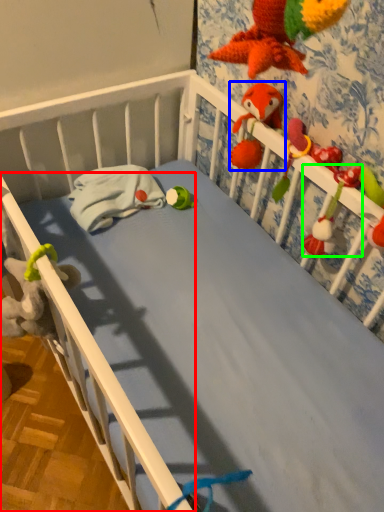
Question: Considering the real-world distances, which object is farthest from rail (highlighted by a red box)? toy (highlighted by a blue box) or toy (highlighted by a green box)?

Choices:
 (A) toy
 (B) toy

Answer: (A)